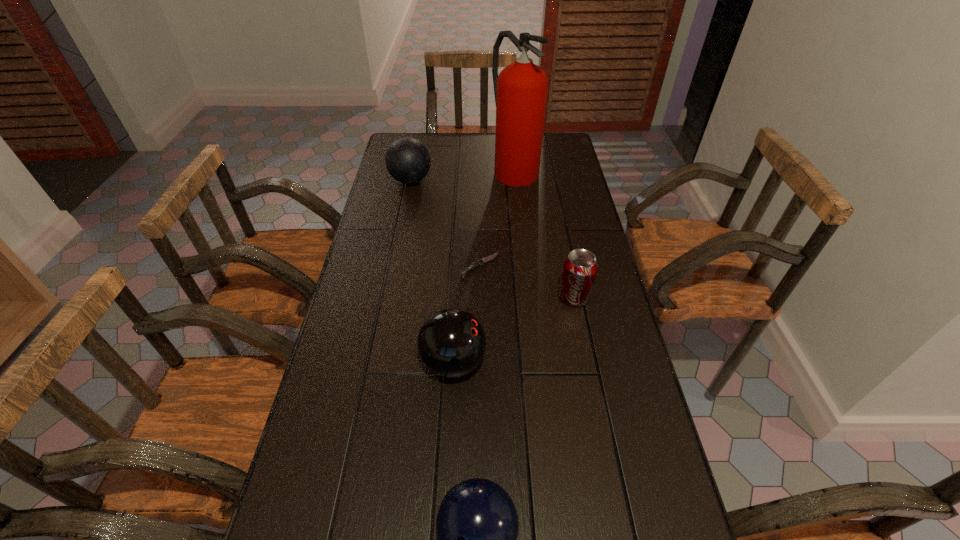
Where is `free region that satisfies the following two spatial constraints: 1. on the grip area of the fourth farthest object; 2. on the left side of the leftmost bowling ball`? free region that satisfies the following two spatial constraints: 1. on the grip area of the fourth farthest object; 2. on the left side of the leftmost bowling ball is located at coordinates (387, 296).

This screenshot has width=960, height=540. In order to click on free spot that satisfies the following two spatial constraints: 1. on the grip area of the leftmost bowling ball; 2. on the left side of the shortest object in this screenshot , I will do `click(394, 266)`.